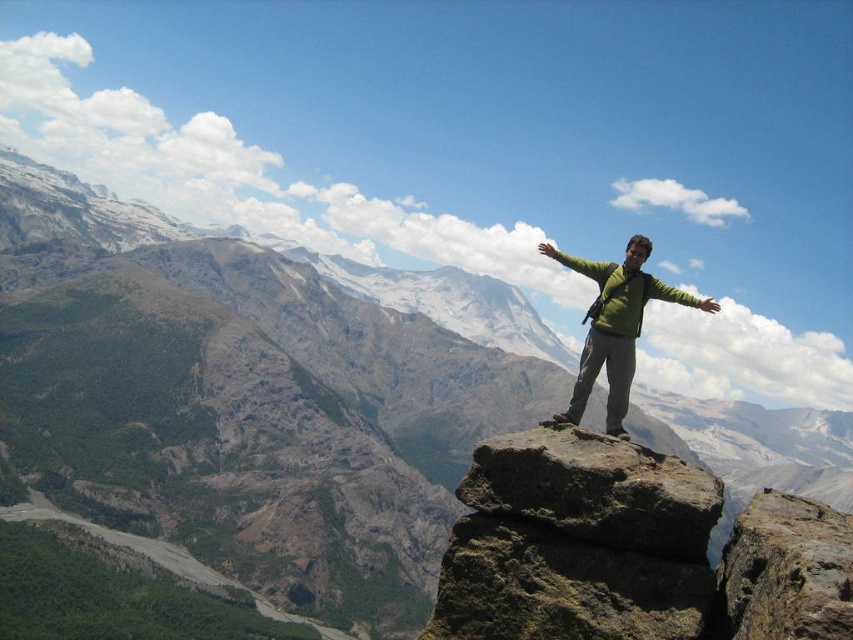
You are a hiker planning to place a 1 meter wide camping mat between the rusty brown rock at center and the green matte jacket at center. Based on the scene, will the space between them be wide enough for the mat?

The rusty brown rock at center is narrower than the green matte jacket at center. However, the exact distance between them isn

You are a hiker trying to navigate between two rocks in the center of the mountain view. The rusty brown rock at center and the brown rough rock at center are both in your path. Which rock is wider so you can choose the better path?

The brown rough rock at center is wider than the rusty brown rock at center, so you should choose the path around the brown rough rock at center for better passage.